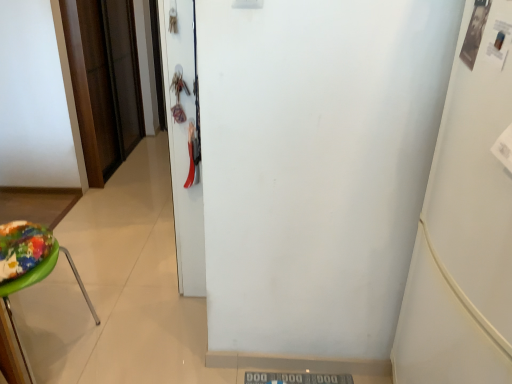
Identify the location of vacant area that is in front of white glossy door at center, which is the 1th door in right-to-left order. (162, 311).